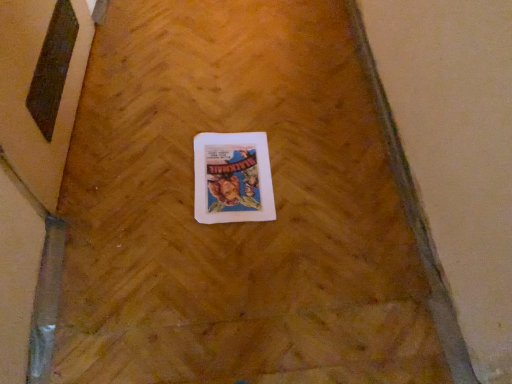
At what (x,y) coordinates should I click in order to perform the action: click on vacant point above matte white card at center (from a real-world perspective). Please return your answer as a coordinate pair (x, y). This screenshot has width=512, height=384. Looking at the image, I should click on (229, 172).